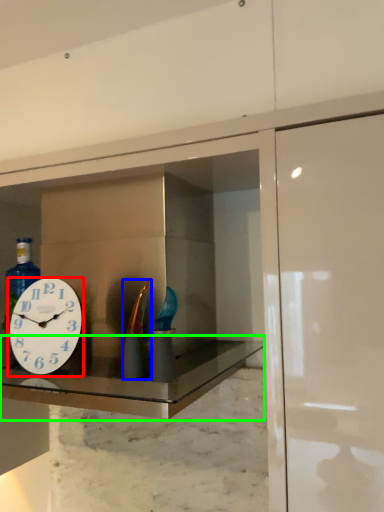
Question: Estimate the real-world distances between objects in this image. Which object is closer to wall clock (highlighted by a red box), bottle (highlighted by a blue box) or counter top (highlighted by a green box)?

Choices:
 (A) bottle
 (B) counter top

Answer: (B)